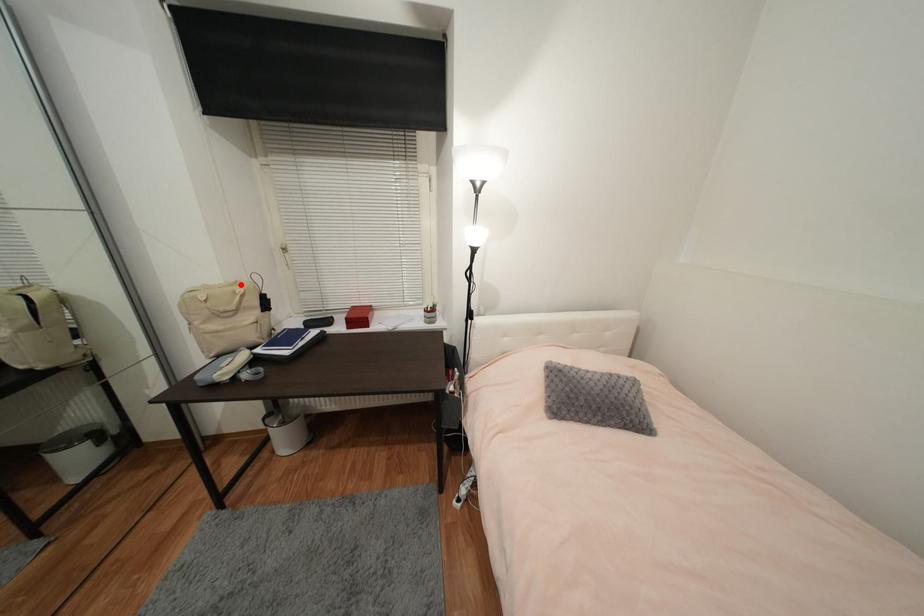
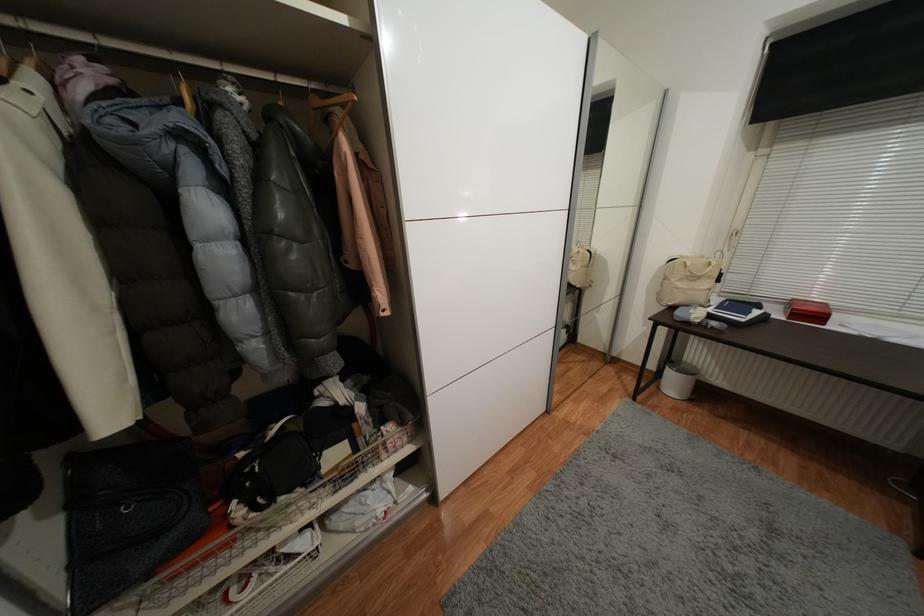
The point at the highlighted location is marked in the first image. Where is the corresponding point in the second image?

(707, 257)